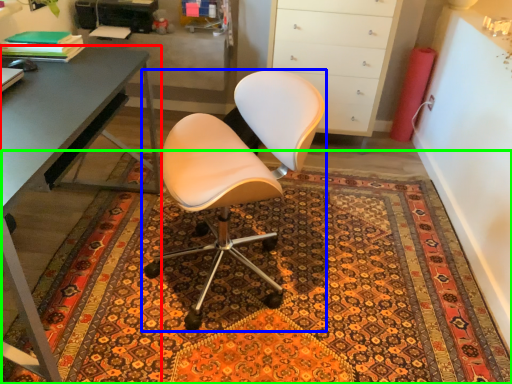
Question: Which object is positioned closest to desk (highlighted by a red box)? Select from chair (highlighted by a blue box) and doormat (highlighted by a green box).

Choices:
 (A) chair
 (B) doormat

Answer: (A)